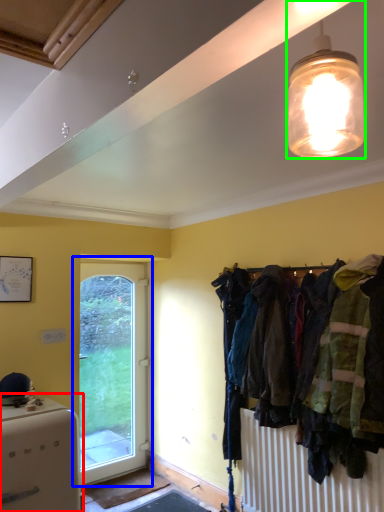
Question: Which object is positioned farthest from appliance (highlighted by a red box)? Select from door (highlighted by a blue box) and lamp (highlighted by a green box).

Choices:
 (A) door
 (B) lamp

Answer: (B)